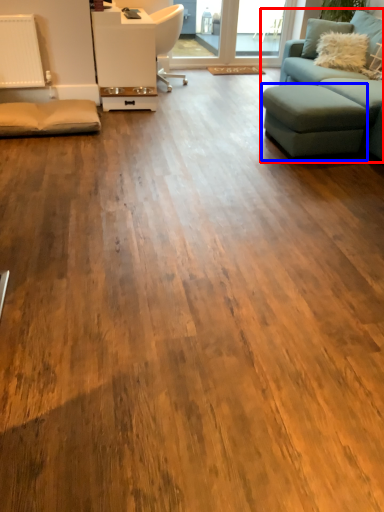
Question: Which object appears closest to the camera in this image, studio couch (highlighted by a red box) or footrest (highlighted by a blue box)?

Choices:
 (A) studio couch
 (B) footrest

Answer: (A)